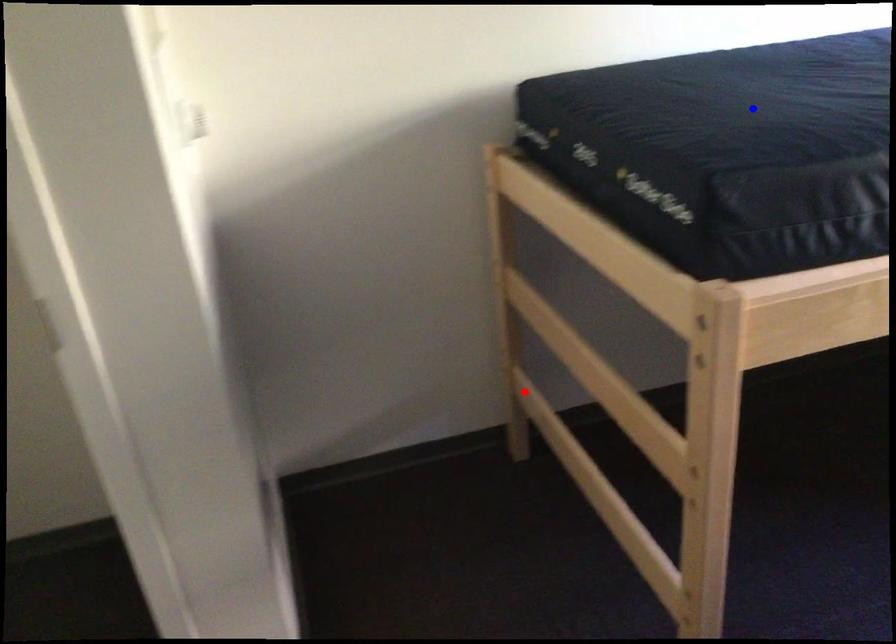
Question: Two points are marked on the image. Which point is closer to the camera?

Choices:
 (A) Blue point is closer.
 (B) Red point is closer.

Answer: (A)